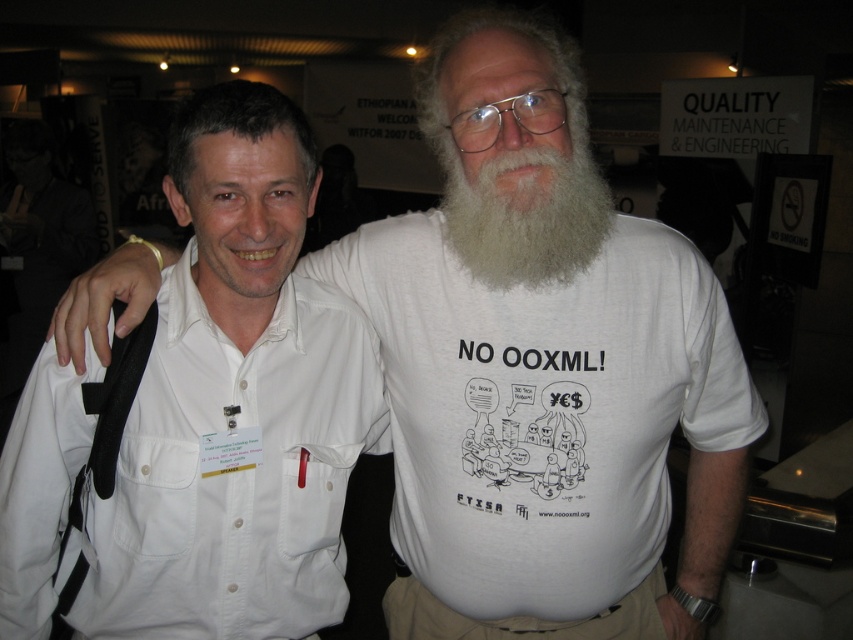
Based on the scene description, which object is taller between the white cotton shirt at left and the khaki pants at lower center?

The white cotton shirt at left is much taller than the khaki pants at lower center according to the description.

You are a photographer at a conference, and you need to capture a closeup shot of the white cotton shirt at left and khaki pants at lower center. Your camera has a minimum focusing distance of 40 centimeters. Can you take the photo without moving the subjects?

The white cotton shirt at left is 39.91 centimeters away from the khaki pants at lower center. Since the distance is slightly less than the camera minimum focusing distance of 40 centimeters, you cannot take the photo without moving the subjects closer together or adjusting the camera settings.

You are standing at the location of the viewer in the image and want to hand a document to the person at point (19, 577). Can you reach them without moving closer?

The distance between the viewer and point (19, 577) is 3.40 feet. Since this distance is greater than typical reaching distance, you cannot reach them without moving closer.